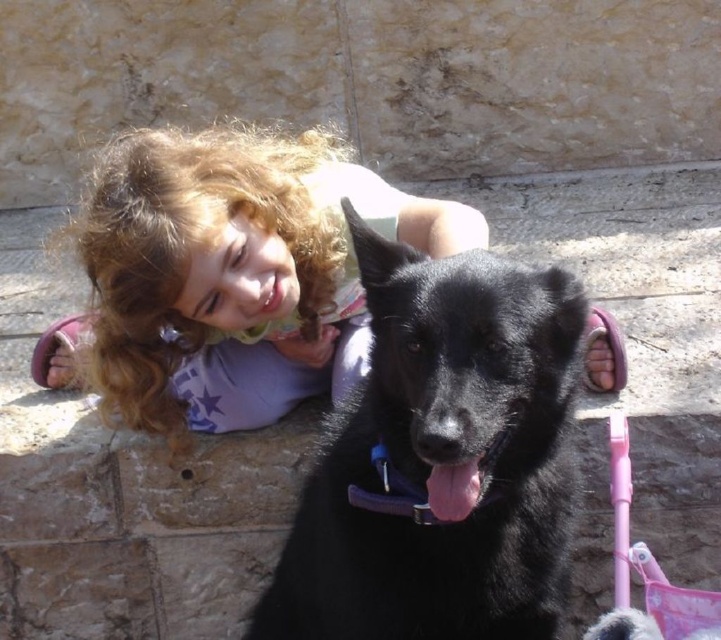
Is black smooth dog at center thinner than curly hair at center?

Yes, black smooth dog at center is thinner than curly hair at center.

Does black smooth dog at center have a larger size compared to curly hair at center?

Actually, black smooth dog at center might be smaller than curly hair at center.

Where is `black smooth dog at center`? The height and width of the screenshot is (640, 721). black smooth dog at center is located at coordinates [442, 460].

Can you confirm if black smooth dog at center is smaller than pink plastic baby carriage at lower right?

Incorrect, black smooth dog at center is not smaller in size than pink plastic baby carriage at lower right.

Can you confirm if black smooth dog at center is thinner than pink plastic baby carriage at lower right?

No, black smooth dog at center is not thinner than pink plastic baby carriage at lower right.

Who is more distant from viewer, (541,508) or (684,628)?

Point (541,508)

Identify the location of black smooth dog at center. Image resolution: width=721 pixels, height=640 pixels. (442, 460).

Can you confirm if curly hair at center is taller than pink plastic baby carriage at lower right?

Indeed, curly hair at center has a greater height compared to pink plastic baby carriage at lower right.

Can you confirm if curly hair at center is smaller than pink plastic baby carriage at lower right?

No, curly hair at center is not smaller than pink plastic baby carriage at lower right.

Is point (249, 259) farther from viewer compared to point (673, 604)?

Yes, it is.

The height and width of the screenshot is (640, 721). What are the coordinates of `curly hair at center` in the screenshot? It's located at (229, 275).